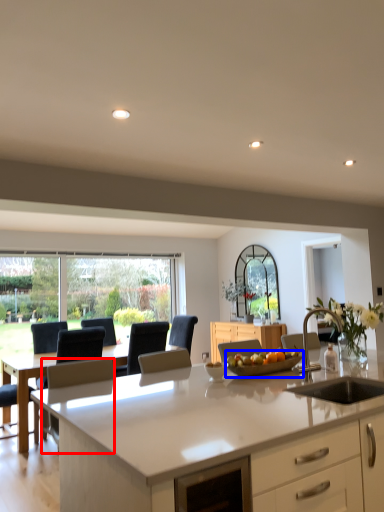
Question: Which object appears farthest to the camera in this image, armchair (highlighted by a red box) or tray (highlighted by a blue box)?

Choices:
 (A) armchair
 (B) tray

Answer: (A)